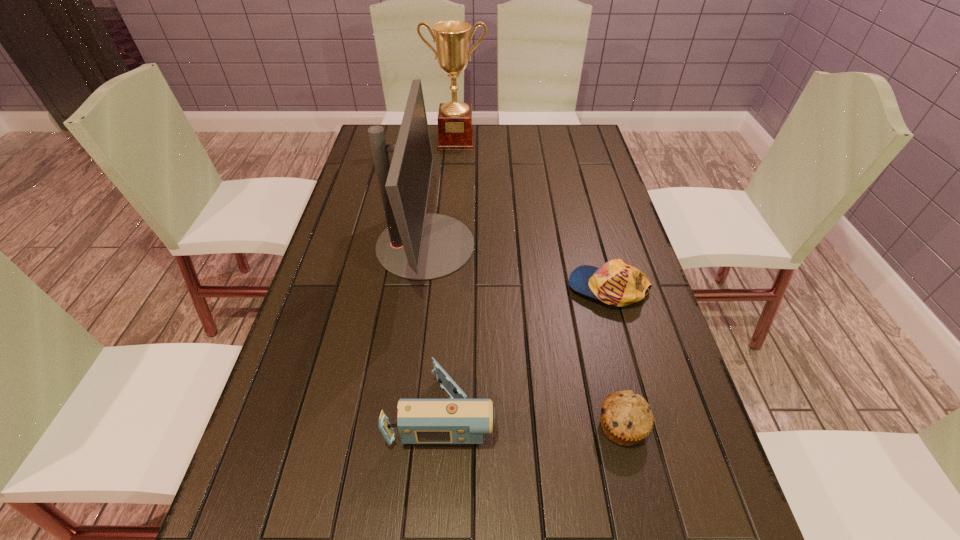
You are a GUI agent. You are given a task and a screenshot of the screen. Output one action in this format:
    pyautogui.click(x=<x>, y=<y>)
    Task: Click on the blank space at the far right corner of the desktop
    The height and width of the screenshot is (540, 960).
    Given the screenshot: What is the action you would take?
    pyautogui.click(x=565, y=152)

Find the location of a particular element. The width and height of the screenshot is (960, 540). free space between the computer monitor and the third tallest object is located at coordinates (435, 328).

I want to click on vacant area between the computer monitor and the muffin, so click(x=523, y=336).

Find the location of a particular element. The width and height of the screenshot is (960, 540). free point between the cap and the camcorder is located at coordinates (526, 350).

The image size is (960, 540). What are the coordinates of `vacant area that lies between the cap and the trophy cup` in the screenshot? It's located at (532, 214).

Locate an element on the screen. vacant region between the trophy cup and the third tallest object is located at coordinates (450, 276).

This screenshot has height=540, width=960. In order to click on free space between the third tallest object and the cap in this screenshot , I will do `click(526, 350)`.

In order to click on unoccupied area between the muffin and the trophy cup in this screenshot , I will do `click(539, 284)`.

Locate an element on the screen. This screenshot has height=540, width=960. vacant area between the cap and the computer monitor is located at coordinates (516, 266).

At what (x,y) coordinates should I click in order to perform the action: click on free space between the cap and the camcorder. Please return your answer as a coordinate pair (x, y). Looking at the image, I should click on (526, 350).